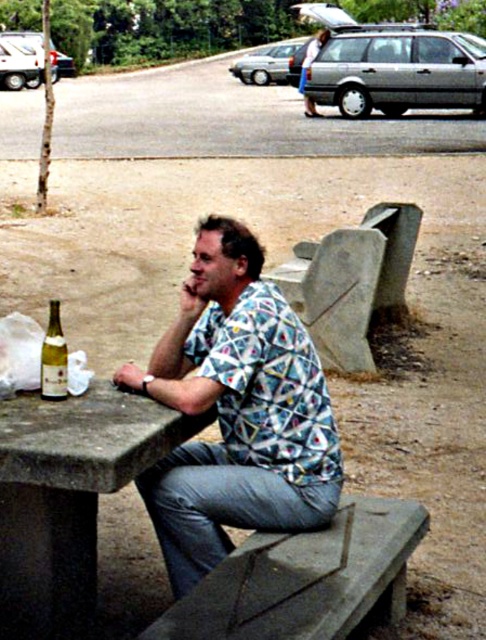
Is point (403, 588) farther from camera compared to point (55, 381)?

Yes, it is.

Is point (330, 529) farther from viewer compared to point (57, 384)?

Yes, point (330, 529) is farther from viewer.

Identify the location of concrete bench at lower center. Image resolution: width=486 pixels, height=640 pixels. (304, 579).

Who is positioned more to the left, concrete table at center or translucent glass bottle at table left?

Positioned to the left is translucent glass bottle at table left.

Where is `concrete table at center`? The image size is (486, 640). concrete table at center is located at coordinates (68, 497).

Can you confirm if printed fabric shirt at center is shorter than concrete bench at lower center?

In fact, printed fabric shirt at center may be taller than concrete bench at lower center.

Does printed fabric shirt at center have a greater height compared to concrete bench at lower center?

Correct, printed fabric shirt at center is much taller as concrete bench at lower center.

Who is more forward, (190, 406) or (335, 595)?

Point (335, 595) is more forward.

You are a GUI agent. You are given a task and a screenshot of the screen. Output one action in this format:
    pyautogui.click(x=<x>, y=<y>)
    Task: Click on the printed fabric shirt at center
    This screenshot has height=640, width=486.
    Given the screenshot: What is the action you would take?
    pyautogui.click(x=237, y=410)